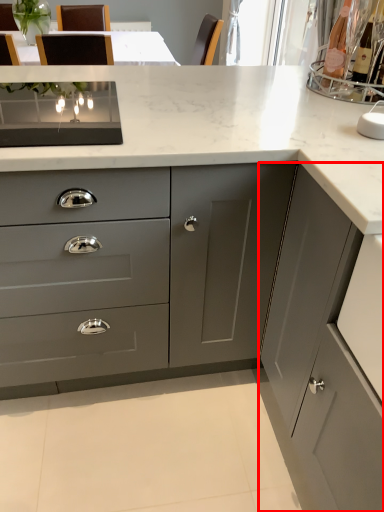
Question: From the image's perspective, what is the correct spatial relationship of cabinetry (annotated by the red box) in relation to cabinetry?

Choices:
 (A) below
 (B) above

Answer: (A)